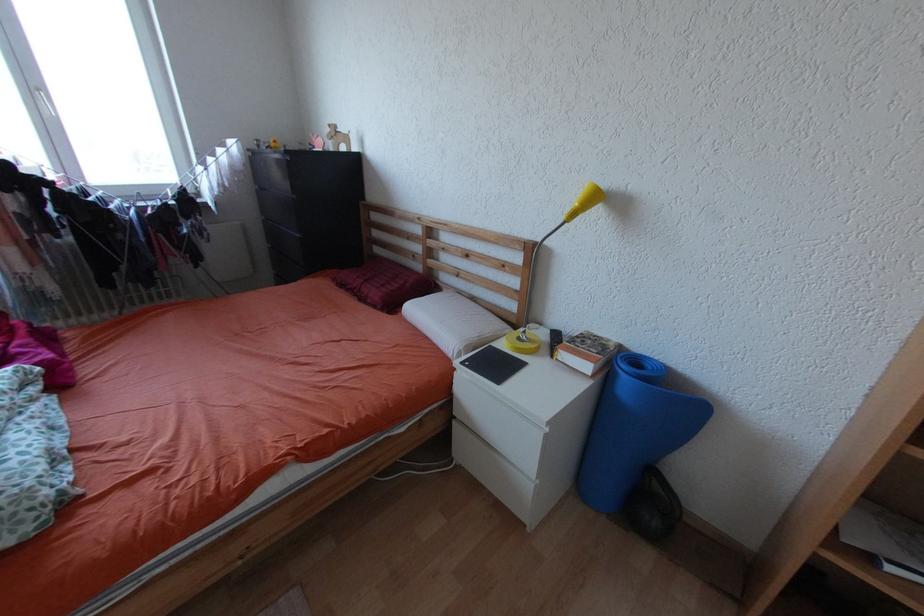
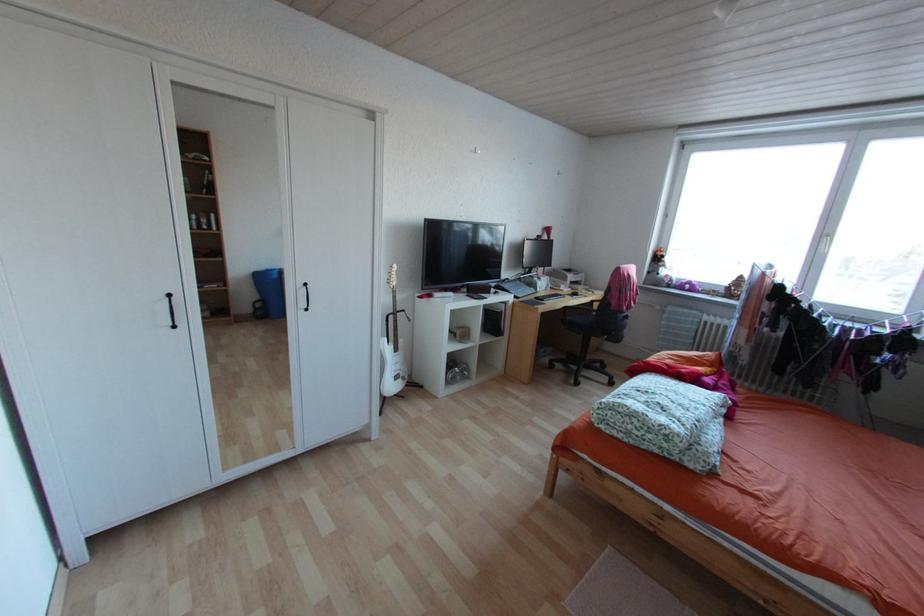
Question: The first image is from the beginning of the video and the second image is from the end. How did the camera likely rotate when shooting the video?

Choices:
 (A) Left
 (B) Right
 (C) Up
 (D) Down

Answer: (A)